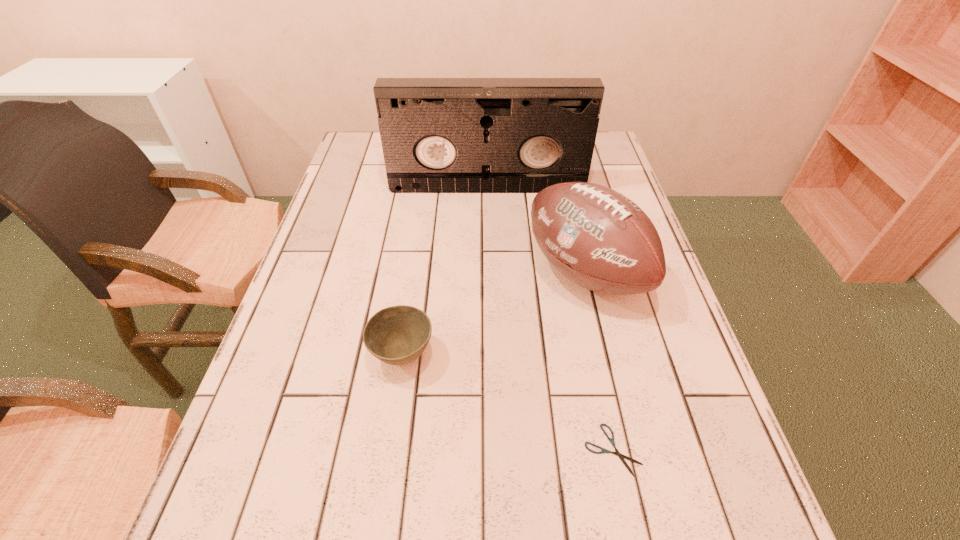
Where is `empty space that is in between the second tallest object and the third farthest object`? The height and width of the screenshot is (540, 960). empty space that is in between the second tallest object and the third farthest object is located at coordinates (493, 314).

Where is `free space that is in between the third farthest object and the second tallest object`? This screenshot has width=960, height=540. free space that is in between the third farthest object and the second tallest object is located at coordinates [493, 314].

Image resolution: width=960 pixels, height=540 pixels. I want to click on free point between the shortest object and the third nearest object, so click(599, 361).

Locate an element on the screen. vacant point located between the football (American) and the bowl is located at coordinates (493, 314).

The height and width of the screenshot is (540, 960). What are the coordinates of `free space between the nearest object and the football (American)` in the screenshot? It's located at (599, 361).

I want to click on empty space between the shortest object and the farthest object, so click(550, 319).

You are a GUI agent. You are given a task and a screenshot of the screen. Output one action in this format:
    pyautogui.click(x=<x>, y=<y>)
    Task: Click on the empty space between the second nearest object and the shears
    The image size is (960, 540).
    Given the screenshot: What is the action you would take?
    (x=508, y=402)

Locate an element on the screen. Image resolution: width=960 pixels, height=540 pixels. object that is the second nearest to the third nearest object is located at coordinates (397, 335).

At what (x,y) coordinates should I click in order to perform the action: click on object that can be found as the second closest to the nearest object. Please return your answer as a coordinate pair (x, y). The image size is (960, 540). Looking at the image, I should click on (397, 335).

This screenshot has height=540, width=960. Find the location of `free region that satisfies the following two spatial constraints: 1. on the back side of the football (American); 2. on the right side of the shortest object`. free region that satisfies the following two spatial constraints: 1. on the back side of the football (American); 2. on the right side of the shortest object is located at coordinates (575, 273).